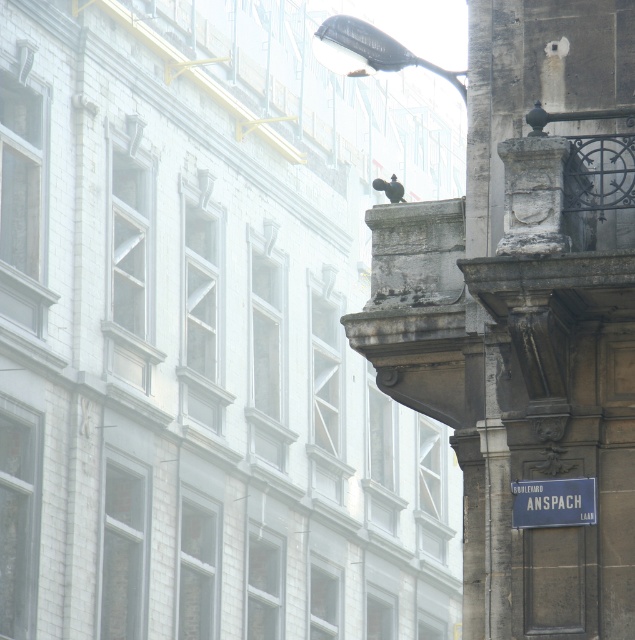
You are a city planner reviewing the urban street scene. You notice the black glass streetlight at upper center and the blue metallic street sign at lower right. Which object would cast a larger shadow during the day?

The black glass streetlight at upper center is bigger than the blue metallic street sign at lower right, so it would cast a larger shadow during the day.

Looking at this image, you are a city planner reviewing the urban street scene. You need to install a new surveillance camera that must be placed exactly 50 meters away from the black glass streetlight at upper center. Based on the current layout, is there enough space to place the camera at the required distance?

The black glass streetlight at upper center and camera are 47.31 meters apart from each other. Since the required distance is 50 meters, there is insufficient space to place the camera at the required distance as the existing distance is shorter than needed.